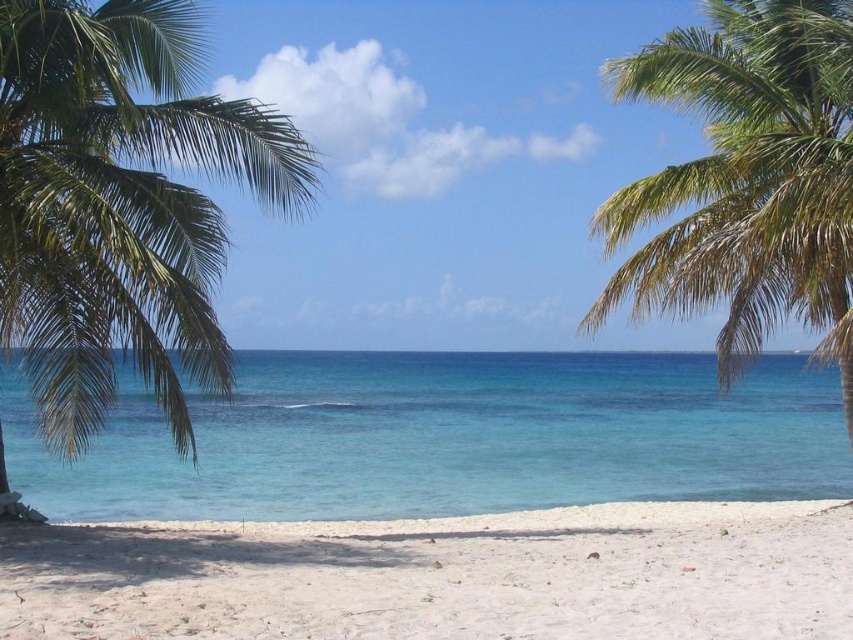
Question: Can you confirm if clear blue water at center is thinner than green leafy palm tree at left?

Choices:
 (A) no
 (B) yes

Answer: (A)

Question: Can you confirm if green leafy palm tree at left is positioned above green leafy palm tree at right?

Choices:
 (A) no
 (B) yes

Answer: (B)

Question: Which object appears closest to the camera in this image?

Choices:
 (A) white sandy beach at lower center
 (B) green leafy palm tree at left

Answer: (A)

Question: Which point is closer to the camera?

Choices:
 (A) clear blue water at center
 (B) white sandy beach at lower center
 (C) green leafy palm tree at left

Answer: (B)

Question: Is white sandy beach at lower center further to camera compared to green leafy palm tree at right?

Choices:
 (A) no
 (B) yes

Answer: (A)

Question: Which point is closer to the camera taking this photo?

Choices:
 (A) (741, 3)
 (B) (326, 417)
 (C) (302, 148)

Answer: (C)